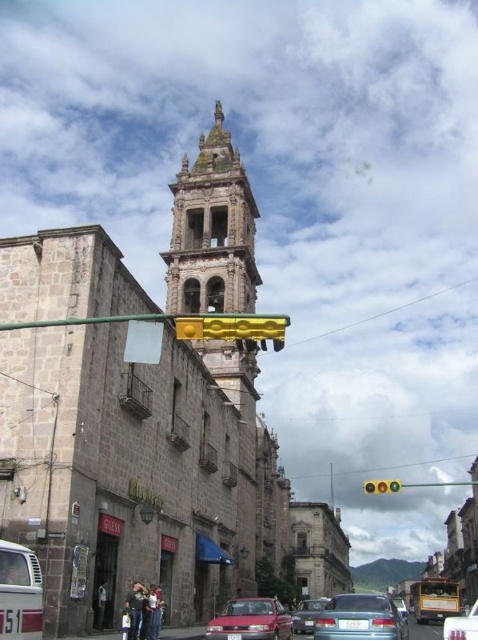
You are a pedestrian standing at the intersection and want to cross the street. You see the stone bell tower at center and the matte red sedan at center. Which object is closer to you as you stand at the intersection?

The matte red sedan at center is closer to you than the stone bell tower at center because the description states that the stone bell tower at center is further to the viewer than the matte red sedan at center.

You are a pedestrian standing at the intersection and want to cross the street. There are two cars in front of you, a metallic silver car at center and a matte red sedan at center. Which car is positioned more to the right side of the street?

The metallic silver car at center is positioned more to the right side of the street as it is to the right of the matte red sedan at center.

You are standing at the intersection and want to cross the street to reach the historic bell tower in the background. The traffic light is yellow. Considering the metallic gray sedan at center is 35.82 meters away from you, will you have enough time to safely cross the street before the light turns red?

The metallic gray sedan at center is 35.82 meters away from the viewer. Since the traffic light is yellow, you should wait for the light to turn green before proceeding to cross safely.